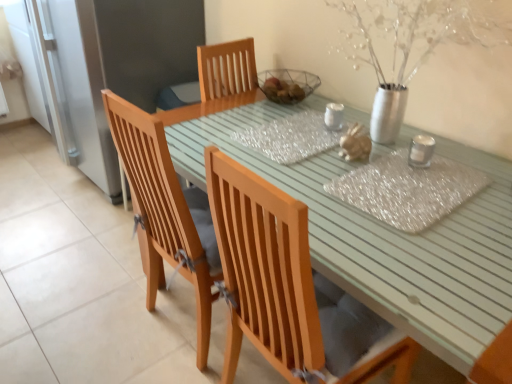
Question: From a real-world perspective, is light green wooden table at center positioned above or below wooden chair at center, which is the 1th chair in top-to-bottom order?

Choices:
 (A) above
 (B) below

Answer: (B)

Question: Considering the positions of light green wooden table at center and wooden chair at center, which is the 1th chair in top-to-bottom order, in the image, is light green wooden table at center taller or shorter than wooden chair at center, which is the 1th chair in top-to-bottom order,?

Choices:
 (A) tall
 (B) short

Answer: (B)

Question: Estimate the real-world distances between objects in this image. Which object is closer to the wooden chair at center, the first chair ordered from the bottom?

Choices:
 (A) light green wooden table at center
 (B) translucent glass jar at center
 (C) wooden chair at center, which is the 1th chair in top-to-bottom order
 (D) clear plastic placemat at center

Answer: (A)

Question: Estimate the real-world distances between objects in this image. Which object is farther from the clear plastic placemat at center?

Choices:
 (A) wooden chair at center, positioned as the 2th chair in top-to-bottom order
 (B) translucent glass jar at center
 (C) light green wooden table at center
 (D) wooden chair at center, which is the 1th chair in top-to-bottom order

Answer: (D)